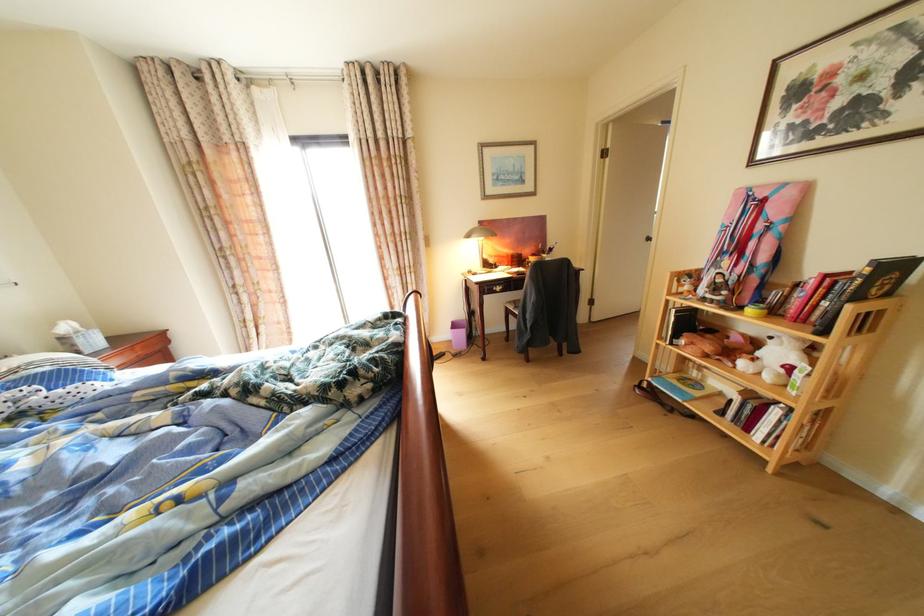
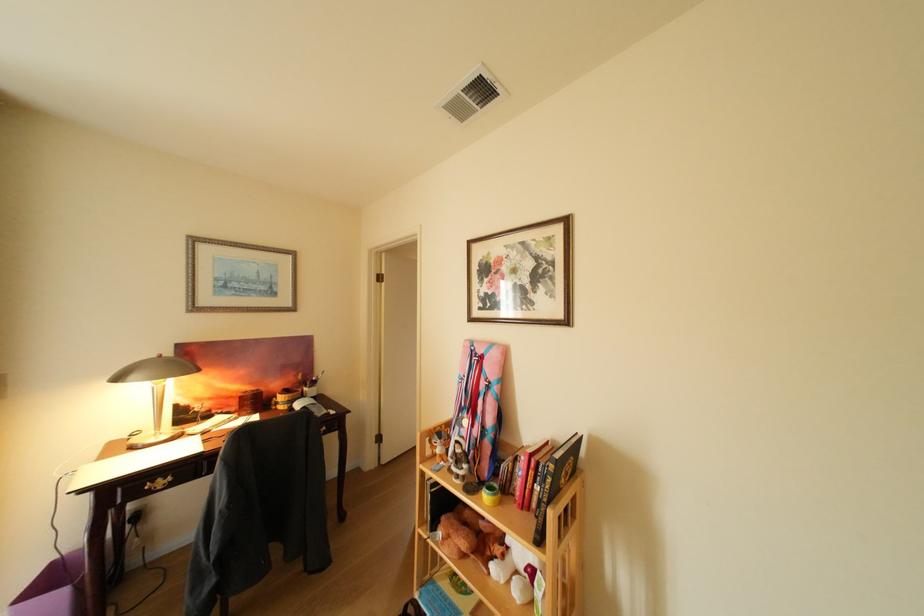
In the second image, find the point that corresponds to [518,253] in the first image.

(251, 389)